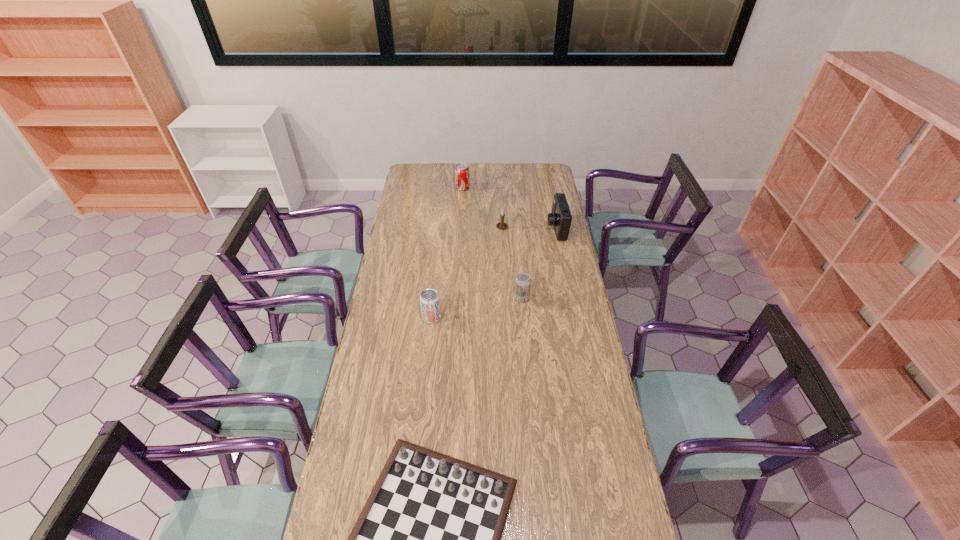
Where is `free spot that satisfies the following two spatial constraints: 1. on the side of the fifth object from left to right with the handle; 2. on the right side of the candle holder`? free spot that satisfies the following two spatial constraints: 1. on the side of the fifth object from left to right with the handle; 2. on the right side of the candle holder is located at coordinates [506, 298].

Find the location of a particular element. This screenshot has width=960, height=540. free location that satisfies the following two spatial constraints: 1. on the back side of the farthest object; 2. on the right side of the fifth farthest object is located at coordinates point(445,188).